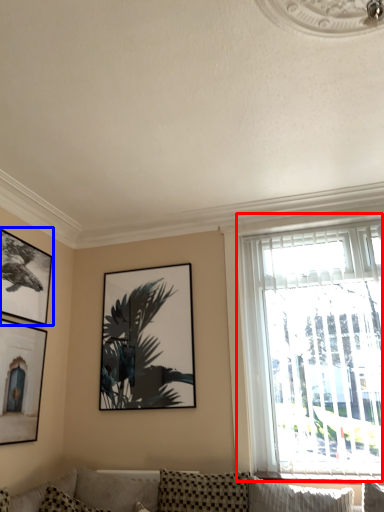
Question: Which object is further to the camera taking this photo, window (highlighted by a red box) or picture frame (highlighted by a blue box)?

Choices:
 (A) window
 (B) picture frame

Answer: (B)